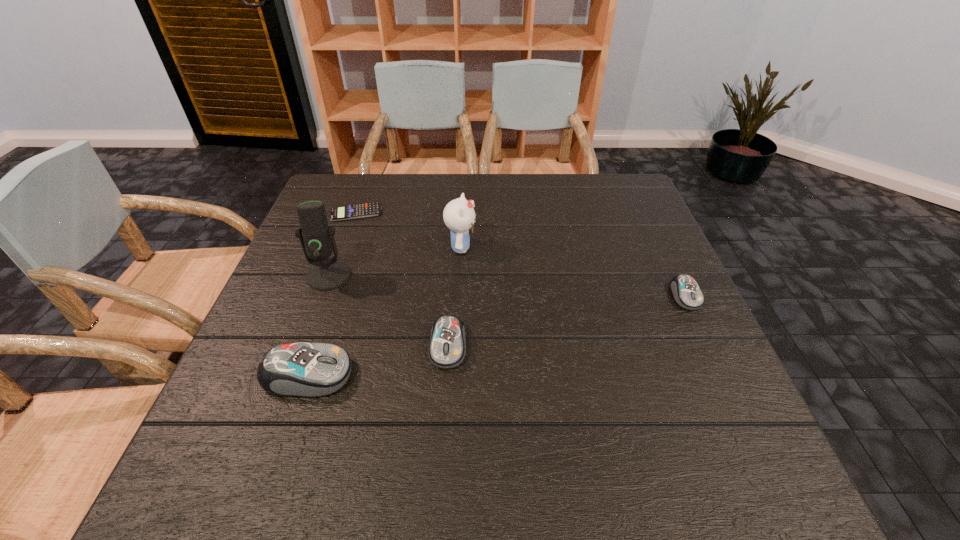
This screenshot has height=540, width=960. I want to click on the fourth shortest object, so click(299, 369).

In order to click on the leftmost computer mouse in this screenshot , I will do `click(299, 369)`.

Identify the location of the fourth tallest object. The image size is (960, 540). (447, 348).

You are a GUI agent. You are given a task and a screenshot of the screen. Output one action in this format:
    pyautogui.click(x=<x>, y=<y>)
    Task: Click on the second computer mouse from left to right
    This screenshot has height=540, width=960.
    Given the screenshot: What is the action you would take?
    pyautogui.click(x=447, y=348)

Find the location of a particular element. Image resolution: width=960 pixels, height=540 pixels. the rightmost computer mouse is located at coordinates (686, 292).

The image size is (960, 540). What are the coordinates of `the farthest computer mouse` in the screenshot? It's located at (686, 292).

The image size is (960, 540). What are the coordinates of `calculator` in the screenshot? It's located at coord(354,211).

What are the coordinates of `the shortest object` in the screenshot? It's located at (354, 211).

At what (x,y) coordinates should I click in order to perform the action: click on microphone. Please return your answer as a coordinate pair (x, y). The width and height of the screenshot is (960, 540). Looking at the image, I should click on (317, 239).

The image size is (960, 540). What are the coordinates of `kitten` in the screenshot? It's located at (459, 216).